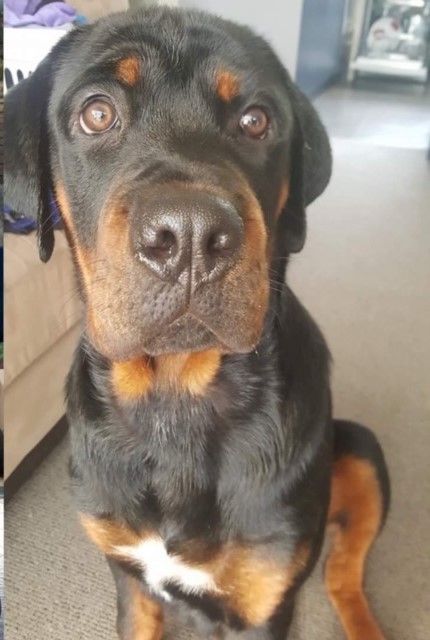
Image resolution: width=430 pixels, height=640 pixels. Find the location of `carpet`. carpet is located at coordinates (392, 324).